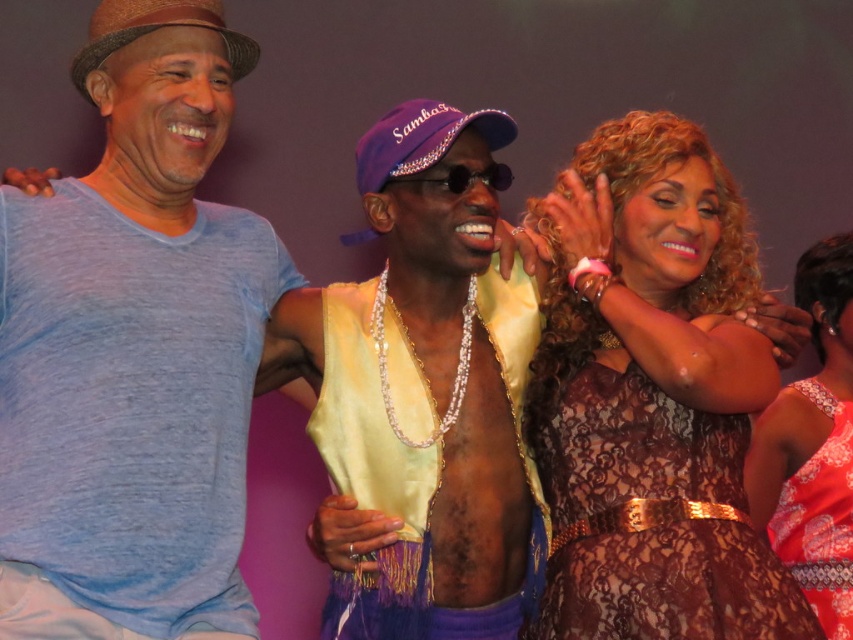
Question: Which point is farther to the camera?

Choices:
 (A) (177, 627)
 (B) (547, 388)
 (C) (747, 499)

Answer: (C)

Question: Which of the following is the closest to the observer?

Choices:
 (A) (39, 264)
 (B) (776, 500)
 (C) (628, 563)

Answer: (A)

Question: Does blue cotton t-shirt at left come in front of lace dress at right?

Choices:
 (A) no
 (B) yes

Answer: (B)

Question: From the image, what is the correct spatial relationship of brown lace dress at center in relation to lace dress at right?

Choices:
 (A) right
 (B) left

Answer: (B)

Question: Which object is positioned closest to the blue cotton t-shirt at left?

Choices:
 (A) brown lace dress at center
 (B) lace dress at right

Answer: (A)

Question: Is blue cotton t-shirt at left bigger than brown lace dress at center?

Choices:
 (A) yes
 (B) no

Answer: (A)